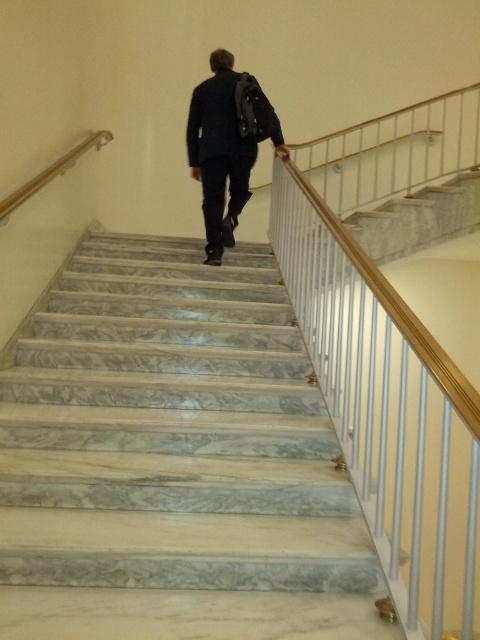
Is dark blue suit at center smaller than wooden handrail at upper left?

No.

Is dark blue suit at center to the left of wooden handrail at upper left from the viewer's perspective?

In fact, dark blue suit at center is to the right of wooden handrail at upper left.

Does point (227, 113) come behind point (31, 179)?

Yes, it is behind point (31, 179).

I want to click on dark blue suit at center, so click(x=227, y=145).

Between marble stairs at center and dark blue suit at center, which one appears on the left side from the viewer's perspective?

From the viewer's perspective, marble stairs at center appears more on the left side.

Is point (235, 532) positioned behind point (266, 132)?

That is False.

Identify the location of marble stairs at center. (173, 460).

Does marble stairs at center have a greater width compared to wooden handrail at upper left?

Yes, marble stairs at center is wider than wooden handrail at upper left.

Can you confirm if marble stairs at center is smaller than wooden handrail at upper left?

No.

Is point (165, 429) positioned after point (45, 173)?

No, (165, 429) is in front of (45, 173).

Image resolution: width=480 pixels, height=640 pixels. Find the location of `marble stairs at center`. marble stairs at center is located at coordinates (173, 460).